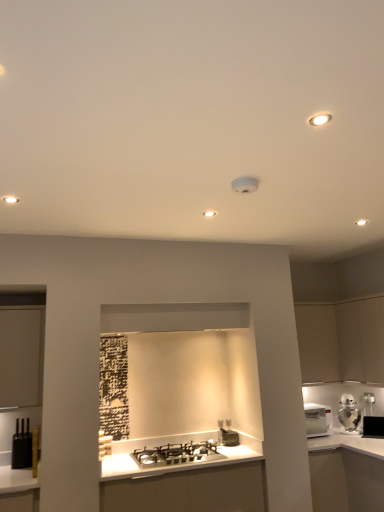
Question: Is matte white cabinet at right, which is the 2th cabinetry from right to left, located outside black glossy microwave at upper right, marked as the first appliance in a right-to-left arrangement?

Choices:
 (A) no
 (B) yes

Answer: (B)

Question: Is black glossy microwave at upper right, which is the 1th appliance from back to front, at the back of matte white cabinet at right, which is counted as the 1th cabinetry, starting from the left?

Choices:
 (A) yes
 (B) no

Answer: (B)

Question: Can you confirm if matte white cabinet at right, which is counted as the 1th cabinetry, starting from the left, is bigger than black glossy microwave at upper right, the third appliance in the front-to-back sequence?

Choices:
 (A) yes
 (B) no

Answer: (A)

Question: From the image's perspective, would you say matte white cabinet at right, which is counted as the 1th cabinetry, starting from the left, is shown under black glossy microwave at upper right, marked as the first appliance in a right-to-left arrangement?

Choices:
 (A) no
 (B) yes

Answer: (A)

Question: Considering the relative sizes of matte white cabinet at right, which is the 2th cabinetry from right to left, and black glossy microwave at upper right, which is the 1th appliance from back to front, in the image provided, is matte white cabinet at right, which is the 2th cabinetry from right to left, thinner than black glossy microwave at upper right, which is the 1th appliance from back to front,?

Choices:
 (A) yes
 (B) no

Answer: (B)

Question: Is black matte toaster at lower left, the first appliance in the front-to-back sequence, in front of or behind matte white cabinet at right, which is counted as the 1th cabinetry, starting from the left, in the image?

Choices:
 (A) behind
 (B) front

Answer: (B)

Question: Is point (28, 445) closer or farther from the camera than point (331, 347)?

Choices:
 (A) farther
 (B) closer

Answer: (B)

Question: In terms of size, does black matte toaster at lower left, which is the 3th appliance in back-to-front order, appear bigger or smaller than matte white cabinet at right, which is counted as the 1th cabinetry, starting from the left?

Choices:
 (A) small
 (B) big

Answer: (A)

Question: Is black matte toaster at lower left, which appears as the first appliance when viewed from the left, taller or shorter than matte white cabinet at right, which is the 2th cabinetry from right to left?

Choices:
 (A) short
 (B) tall

Answer: (A)

Question: In terms of height, does shiny silver gas stove at center look taller or shorter compared to silver metallic ice bucket at right?

Choices:
 (A) short
 (B) tall

Answer: (A)

Question: Looking at the image, does shiny silver gas stove at center seem bigger or smaller compared to silver metallic ice bucket at right?

Choices:
 (A) small
 (B) big

Answer: (B)

Question: From the image's perspective, is shiny silver gas stove at center above or below silver metallic ice bucket at right?

Choices:
 (A) above
 (B) below

Answer: (B)

Question: In terms of width, does shiny silver gas stove at center look wider or thinner when compared to silver metallic ice bucket at right?

Choices:
 (A) thin
 (B) wide

Answer: (B)

Question: Considering the positions of white glossy countertop at right and black glossy microwave at upper right, which is the 1th appliance from back to front, in the image, is white glossy countertop at right bigger or smaller than black glossy microwave at upper right, which is the 1th appliance from back to front,?

Choices:
 (A) big
 (B) small

Answer: (A)

Question: From a real-world perspective, is white glossy countertop at right above or below black glossy microwave at upper right, marked as the first appliance in a right-to-left arrangement?

Choices:
 (A) below
 (B) above

Answer: (A)